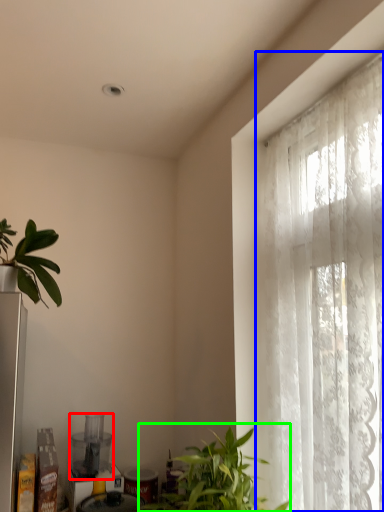
Question: Which object is positioned farthest from appliance (highlighted by a red box)? Select from window (highlighted by a blue box) and houseplant (highlighted by a green box).

Choices:
 (A) window
 (B) houseplant

Answer: (A)